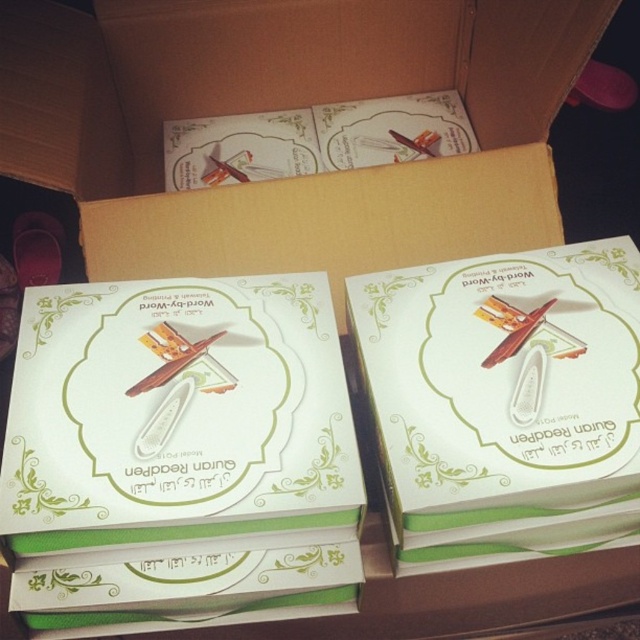
From the picture: You are a delivery person who needs to place a new box of Quran ReadPen pens into the existing arrangement. The new box must be placed at point (177,413). What object is currently at that location?

The white paperboard box at center is currently at point (177,413).

You are organizing a stationery store and need to place the white paperboard box at center and the white matte eraser at center on a shelf. Which item should you place first if you want to follow the rule of putting larger items at the bottom for stability?

You should place the white paperboard box at center first because it has a larger size compared to the white matte eraser at center, ensuring stability by placing the bigger item at the bottom.